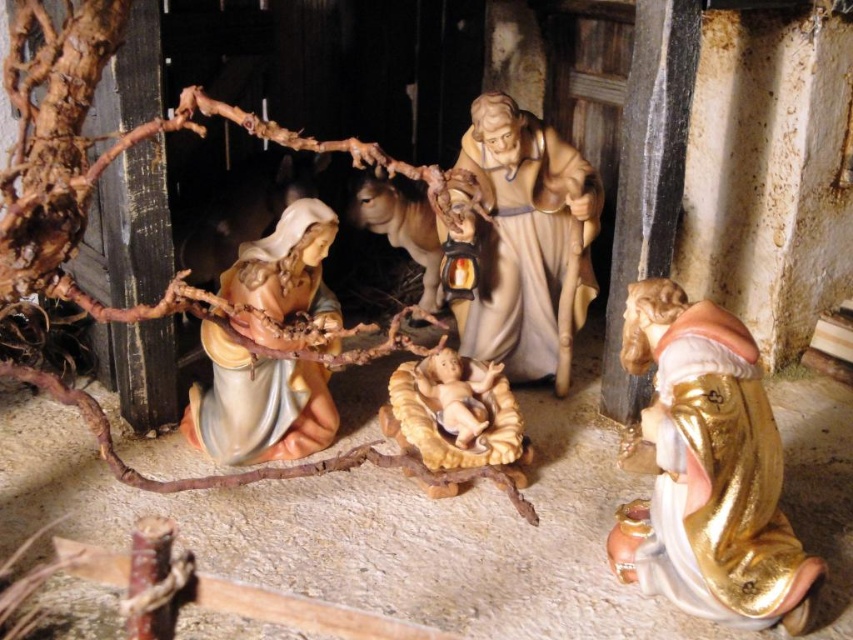
Consider the image. Can you confirm if gold glossy statue at lower right is shorter than matte beige statue at center?

No, gold glossy statue at lower right is not shorter than matte beige statue at center.

Between point (711, 477) and point (308, 385), which one is positioned behind?

The point (308, 385) is behind.

Does point (663, 426) come farther from viewer compared to point (287, 266)?

No, (663, 426) is in front of (287, 266).

This screenshot has width=853, height=640. I want to click on gold glossy statue at lower right, so click(712, 467).

Does gold glossy statue at lower right appear on the right side of smooth beige baby at center?

Correct, you'll find gold glossy statue at lower right to the right of smooth beige baby at center.

Where is `gold glossy statue at lower right`? This screenshot has height=640, width=853. gold glossy statue at lower right is located at coordinates click(x=712, y=467).

What do you see at coordinates (712, 467) in the screenshot?
I see `gold glossy statue at lower right` at bounding box center [712, 467].

Where is `gold glossy statue at lower right`? The height and width of the screenshot is (640, 853). gold glossy statue at lower right is located at coordinates (712, 467).

Does matte beige statue at center have a lesser height compared to smooth beige baby at center?

In fact, matte beige statue at center may be taller than smooth beige baby at center.

Is matte beige statue at center thinner than smooth beige baby at center?

No, matte beige statue at center is not thinner than smooth beige baby at center.

At what (x,y) coordinates should I click in order to perform the action: click on matte beige statue at center. Please return your answer as a coordinate pair (x, y). Looking at the image, I should click on (257, 404).